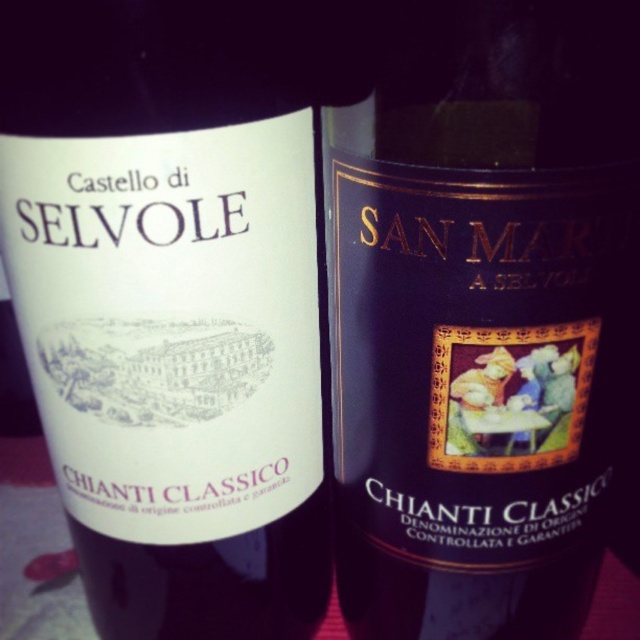
Can you confirm if white matte wine bottle at center is thinner than dark purple matte bottle at center?

Indeed, white matte wine bottle at center has a lesser width compared to dark purple matte bottle at center.

Who is shorter, white matte wine bottle at center or dark purple matte bottle at center?

dark purple matte bottle at center

Does point (208, 390) lie in front of point (429, 502)?

Yes, point (208, 390) is closer to viewer.

At what (x,y) coordinates should I click in order to perform the action: click on white matte wine bottle at center. Please return your answer as a coordinate pair (x, y). Looking at the image, I should click on (172, 305).